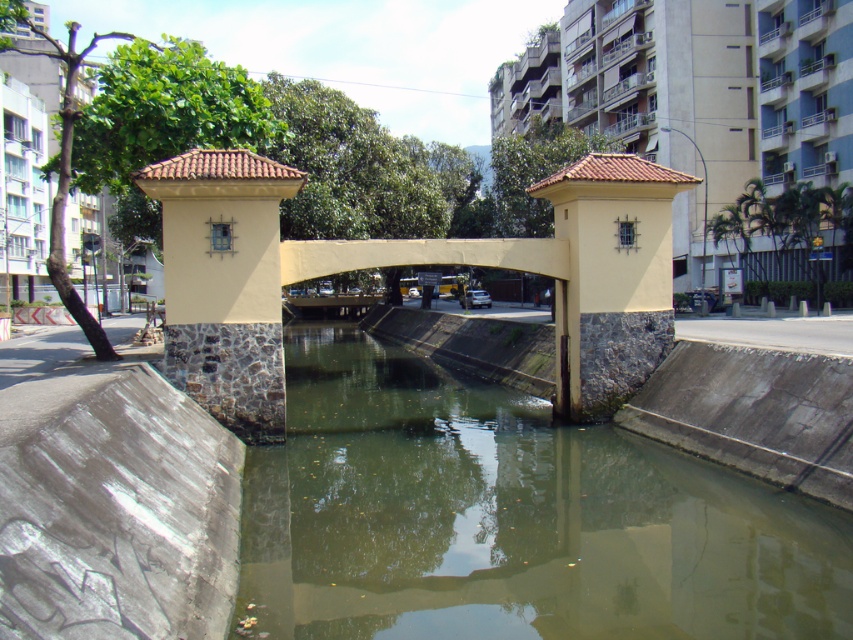
Who is taller, greenish concrete water at center or matte yellow stone bridge at center?

matte yellow stone bridge at center is taller.

What do you see at coordinates (508, 518) in the screenshot?
I see `greenish concrete water at center` at bounding box center [508, 518].

Where is `greenish concrete water at center`? The height and width of the screenshot is (640, 853). greenish concrete water at center is located at coordinates (508, 518).

Is matte yellow stone bridge at center positioned before yellow stone pillar at center?

No, it is behind yellow stone pillar at center.

Does point (604, 410) come behind point (245, 326)?

Yes, point (604, 410) is behind point (245, 326).

Does point (231, 416) come farther from viewer compared to point (227, 276)?

Yes, point (231, 416) is farther from viewer.

At what (x,y) coordinates should I click in order to perform the action: click on matte yellow stone bridge at center. Please return your answer as a coordinate pair (x, y). The width and height of the screenshot is (853, 640). Looking at the image, I should click on (403, 262).

Who is more forward, (490, 614) or (177, 172)?

Point (490, 614) is more forward.

Who is lower down, greenish concrete water at center or yellow stone pillar at center?

Positioned lower is greenish concrete water at center.

Between point (297, 452) and point (206, 230), which one is positioned in front?

Point (206, 230)

The image size is (853, 640). I want to click on greenish concrete water at center, so click(508, 518).